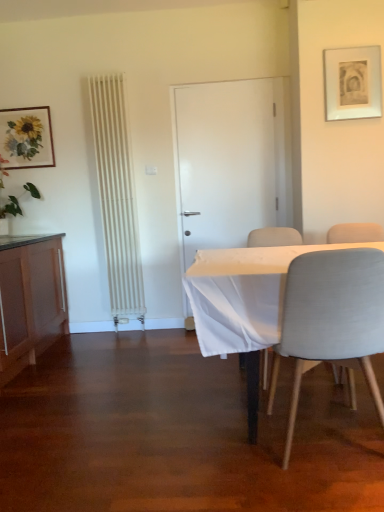
Question: From a real-world perspective, is green leafy plant at left positioned under white matte door at center based on gravity?

Choices:
 (A) yes
 (B) no

Answer: (B)

Question: Is the position of green leafy plant at left less distant than that of white matte door at center?

Choices:
 (A) no
 (B) yes

Answer: (B)

Question: Could you tell me if green leafy plant at left is facing white matte door at center?

Choices:
 (A) no
 (B) yes

Answer: (B)

Question: Is green leafy plant at left outside of white matte door at center?

Choices:
 (A) no
 (B) yes

Answer: (B)

Question: Considering the relative sizes of green leafy plant at left and white matte door at center in the image provided, is green leafy plant at left bigger than white matte door at center?

Choices:
 (A) yes
 (B) no

Answer: (A)

Question: Can you confirm if green leafy plant at left is positioned to the right of white matte door at center?

Choices:
 (A) no
 (B) yes

Answer: (A)

Question: Does light gray fabric chair at lower right, the third chair positioned from the back, come behind light gray fabric chair at right, the second chair positioned from the back?

Choices:
 (A) yes
 (B) no

Answer: (B)

Question: Considering the relative sizes of light gray fabric chair at lower right, the third chair positioned from the back, and light gray fabric chair at right, arranged as the second chair when viewed from the front, in the image provided, is light gray fabric chair at lower right, the third chair positioned from the back, bigger than light gray fabric chair at right, arranged as the second chair when viewed from the front,?

Choices:
 (A) yes
 (B) no

Answer: (A)

Question: Is light gray fabric chair at lower right, the third chair positioned from the back, directly adjacent to light gray fabric chair at right, arranged as the second chair when viewed from the front?

Choices:
 (A) yes
 (B) no

Answer: (B)

Question: Considering the relative positions of light gray fabric chair at lower right, the third chair positioned from the back, and light gray fabric chair at right, arranged as the second chair when viewed from the front, in the image provided, is light gray fabric chair at lower right, the third chair positioned from the back, to the left of light gray fabric chair at right, arranged as the second chair when viewed from the front, from the viewer's perspective?

Choices:
 (A) yes
 (B) no

Answer: (A)

Question: Considering the relative sizes of light gray fabric chair at lower right, the third chair positioned from the back, and light gray fabric chair at right, the second chair positioned from the back, in the image provided, is light gray fabric chair at lower right, the third chair positioned from the back, shorter than light gray fabric chair at right, the second chair positioned from the back,?

Choices:
 (A) no
 (B) yes

Answer: (A)

Question: Would you say light gray fabric chair at lower right, the 1th chair in the front-to-back sequence, is a long distance from light gray fabric chair at right, arranged as the second chair when viewed from the front?

Choices:
 (A) yes
 (B) no

Answer: (A)

Question: Can you confirm if matte wood cabinet at left is bigger than matte white picture frame at upper right, which appears as the second picture frame when viewed from the back?

Choices:
 (A) yes
 (B) no

Answer: (A)